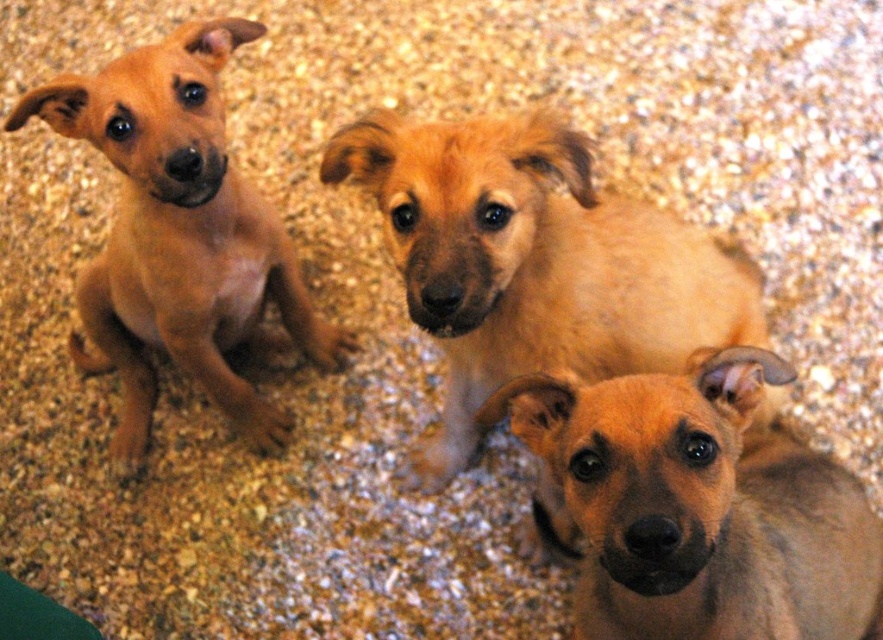
You are a dog breeder observing three puppies. You notice the light brown fur at center and the matte brown puppy at left. Which puppy has a larger size?

The light brown fur at center is bigger than the matte brown puppy at left.

You are a photographer setting up a tripod to take a portrait of the brown fur puppy at center and the matte brown puppy at left. Since you want to focus on the one closer to you, which puppy should you aim the camera at?

The brown fur puppy at center is closer to the viewer than the matte brown puppy at left, so you should aim the camera at the brown fur puppy at center to focus on the closer one.

You are a dog trainer observing three puppies on a gravel floor. You notice the light brown fur at center and the brown fur puppy at center. How far apart are these two features?

The light brown fur at center and the brown fur puppy at center are 10.79 inches apart from each other.